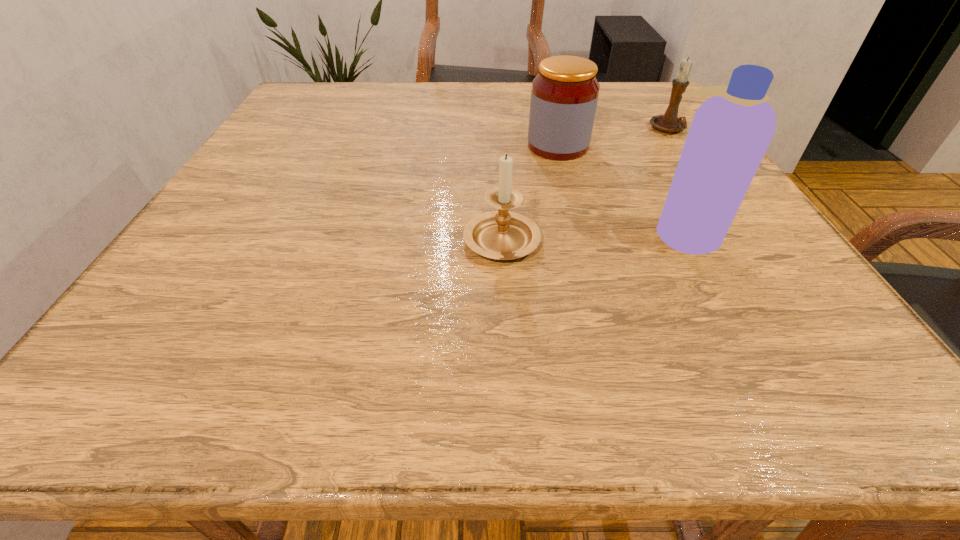
Locate an element on the screen. This screenshot has width=960, height=540. free space located 0.210m on the side of the right candle holder with the handle is located at coordinates point(711,192).

Locate an element on the screen. object located in the far edge section of the desktop is located at coordinates (669, 122).

The width and height of the screenshot is (960, 540). In order to click on shampoo that is positioned at the right edge in this screenshot , I will do (x=730, y=132).

Where is `candle holder present at the right edge`? This screenshot has width=960, height=540. candle holder present at the right edge is located at coordinates (669, 122).

Find the location of a particular element. The width and height of the screenshot is (960, 540). object that is at the far right corner is located at coordinates (669, 122).

Identify the location of free region at the far edge. This screenshot has width=960, height=540. (516, 111).

The height and width of the screenshot is (540, 960). In order to click on free space at the near edge of the desktop in this screenshot , I will do `click(664, 389)`.

Locate an element on the screen. free point at the left edge is located at coordinates 296,176.

Where is `vacant space at the far left corner`? The image size is (960, 540). vacant space at the far left corner is located at coordinates (319, 87).

The height and width of the screenshot is (540, 960). I want to click on free space at the far right corner, so click(x=665, y=103).